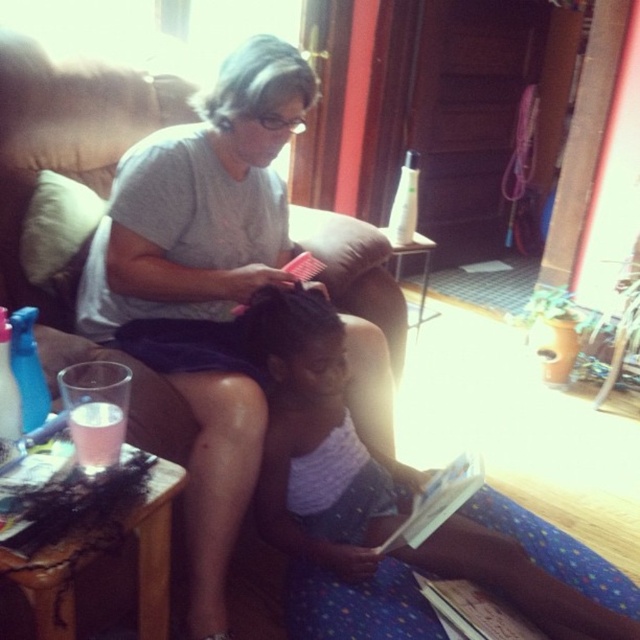
You are organizing a clothing donation drive and need to determine which items can fit into a small donation box. Based on the scene, which item between the matte gray shirt at center and the pink fabric dress at center is more likely to fit into the box?

The matte gray shirt at center has a lesser width compared to the pink fabric dress at center, so it is more likely to fit into the small donation box.